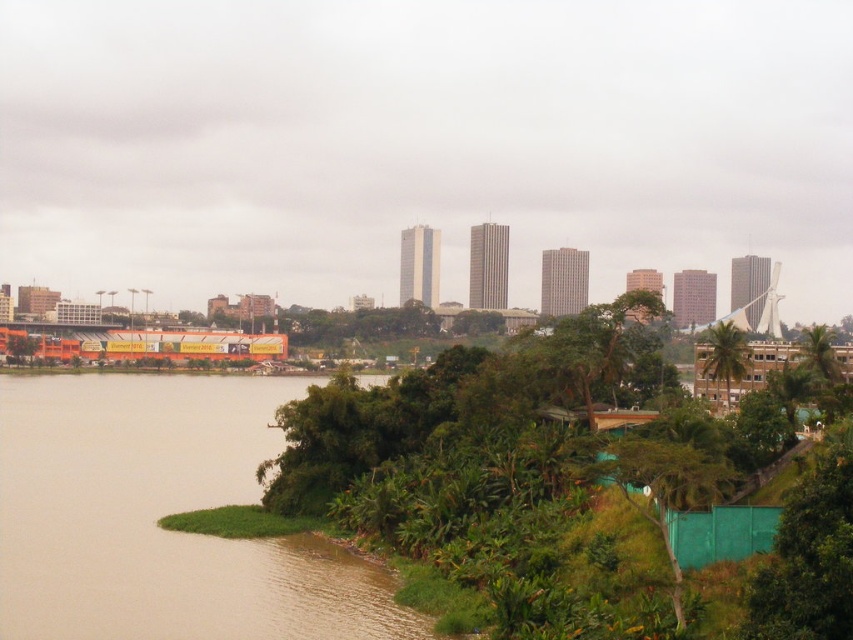
Question: Among these objects, which one is farthest from the camera?

Choices:
 (A) green leafy tree at center
 (B) green leafy tree at center-right

Answer: (B)

Question: Based on their relative distances, which object is nearer to the brown sedimentary river at lower left?

Choices:
 (A) green leafy tree at center-right
 (B) green leafy tree at center

Answer: (B)

Question: Is green leafy tree at center above green leafy tree at center-right?

Choices:
 (A) no
 (B) yes

Answer: (A)

Question: Is green leafy tree at center further to camera compared to green leafy tree at center-right?

Choices:
 (A) yes
 (B) no

Answer: (B)

Question: Does brown sedimentary river at lower left appear over green leafy tree at center-right?

Choices:
 (A) yes
 (B) no

Answer: (B)

Question: Which is farther from the green leafy tree at center-right?

Choices:
 (A) brown sedimentary river at lower left
 (B) green leafy tree at center

Answer: (A)